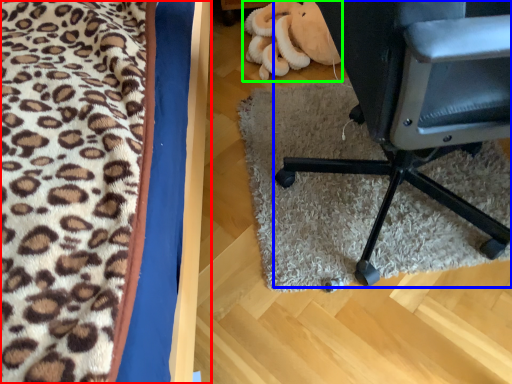
Question: Considering the real-world distances, which object is farthest from furniture (highlighted by a red box)? chair (highlighted by a blue box) or stuff (highlighted by a green box)?

Choices:
 (A) chair
 (B) stuff

Answer: (B)